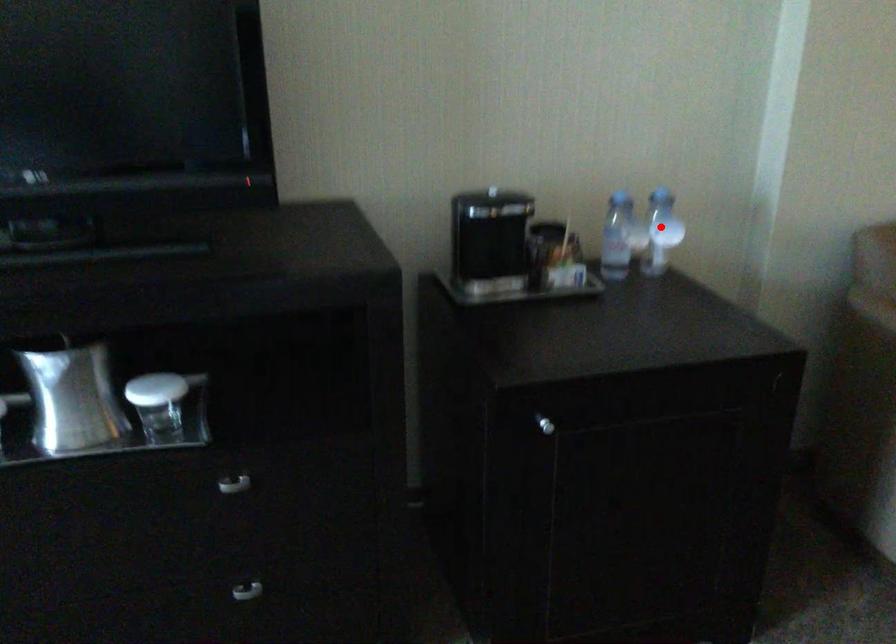
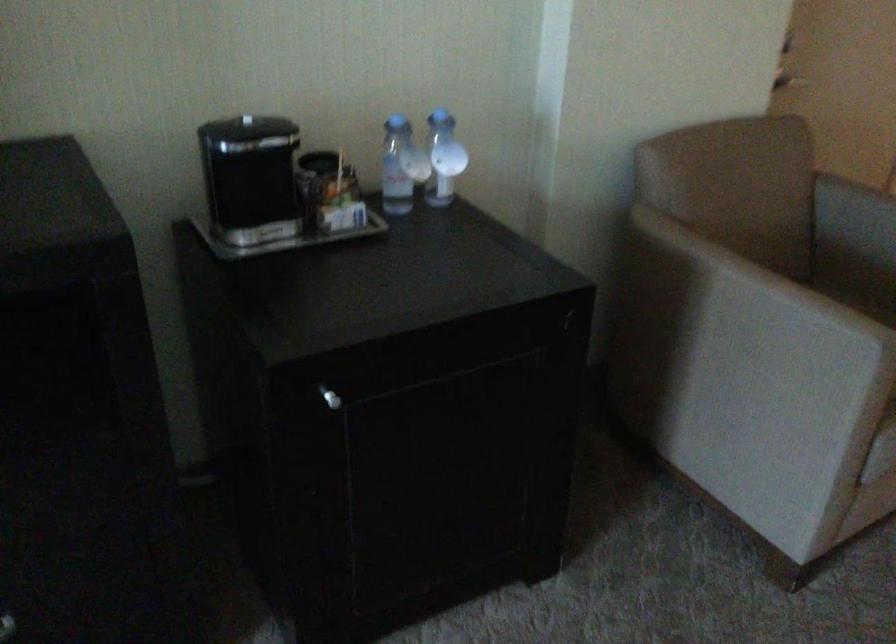
Where in the second image is the point corresponding to the highlighted location from the first image?

(443, 158)